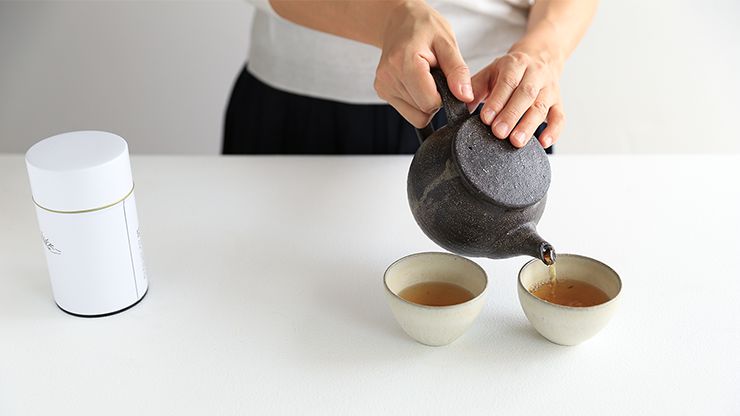
Identify the location of white round canister sitting on countertop, left side. The image size is (740, 416). (81, 240), (84, 281).